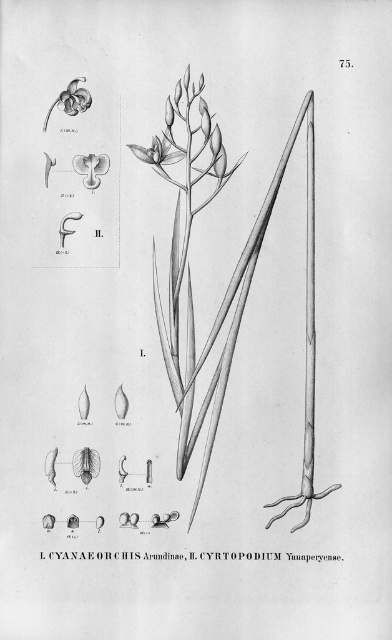
You are a botanist examining the botanical illustration of CYANAEOCHIS Arundinae and CYRTOPODIUM Yanaperyense. You notice two matte white flowers in the image. How far apart are the matte white flower at upper center and the matte white flower at upper left?

The matte white flower at upper center is 2.93 inches from the matte white flower at upper left.